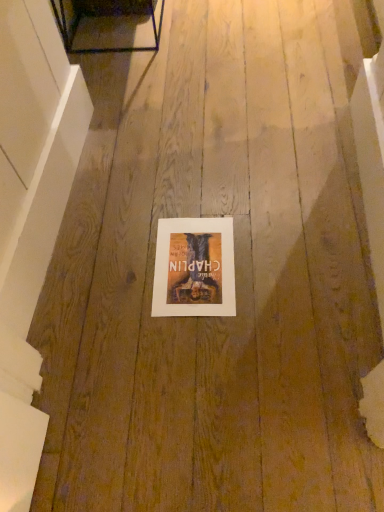
This screenshot has width=384, height=512. Identify the location of free spot above white smooth wall at left (from a real-world perspective). click(41, 154).